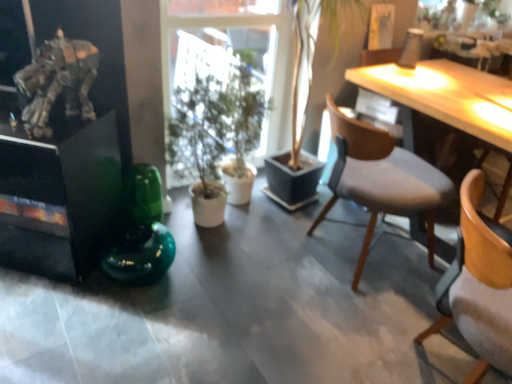
In the scene shown: What is the approximate height of wooden chair at right, which appears as the first chair when viewed from the front?

wooden chair at right, which appears as the first chair when viewed from the front, is 30.81 inches tall.

Based on the photo, measure the distance between point (415, 201) and camera.

Point (415, 201) and camera are 1.80 meters apart from each other.

Find the location of a particular element. Image resolution: width=512 pixels, height=384 pixels. metallic silver robot at upper left is located at coordinates (58, 82).

I want to click on light wood desk at upper right, so click(x=444, y=98).

Identify the location of green matte plant at center. The width and height of the screenshot is (512, 384). (216, 136).

Locate an element on the screen. wooden chair at right, which appears as the first chair when viewed from the front is located at coordinates (478, 285).

Is point (361, 136) in front of point (65, 88)?

Yes, point (361, 136) is closer to viewer.

Which object is positioned more to the left, wooden chair with grey cushion at right, positioned as the first chair in back-to-front order, or metallic silver robot at upper left?

metallic silver robot at upper left.

Which of these two, wooden chair with grey cushion at right, which ranks as the 2th chair in front-to-back order, or metallic silver robot at upper left, is thinner?

Thinner between the two is metallic silver robot at upper left.

Considering their positions, is green glass vase at center located in front of or behind metallic silver robot at upper left?

In the image, green glass vase at center appears behind metallic silver robot at upper left.

Who is shorter, green glass vase at center or metallic silver robot at upper left?

metallic silver robot at upper left is shorter.

Is green glass vase at center not near metallic silver robot at upper left?

They are positioned close to each other.

Considering the sizes of objects green glass vase at center and metallic silver robot at upper left in the image provided, who is wider, green glass vase at center or metallic silver robot at upper left?

metallic silver robot at upper left.

Considering the positions of objects metallic silver robot at upper left and green glass vase at center in the image provided, who is more to the left, metallic silver robot at upper left or green glass vase at center?

From the viewer's perspective, metallic silver robot at upper left appears more on the left side.

From a real-world perspective, is metallic silver robot at upper left above or below green glass vase at center?

metallic silver robot at upper left is above green glass vase at center.

Is green glass vase at center at the back of metallic silver robot at upper left?

metallic silver robot at upper left is not turned away from green glass vase at center.

Is green matte plant at center beside green glass vase at center?

No, green matte plant at center is not in contact with green glass vase at center.

From the image's perspective, which one is positioned lower, green matte plant at center or green glass vase at center?

green glass vase at center.

In the scene shown: Would you say green glass vase at center is part of green matte plant at center's contents?

No.

From the picture: Does metallic silver robot at upper left touch wooden chair with grey cushion at right, which ranks as the 2th chair in front-to-back order?

No, metallic silver robot at upper left is not next to wooden chair with grey cushion at right, which ranks as the 2th chair in front-to-back order.

Would you say wooden chair with grey cushion at right, positioned as the first chair in back-to-front order, is part of metallic silver robot at upper left's contents?

No.

From the picture: Which of these two, metallic silver robot at upper left or wooden chair with grey cushion at right, positioned as the first chair in back-to-front order, stands taller?

wooden chair with grey cushion at right, positioned as the first chair in back-to-front order.

Does point (145, 192) come in front of point (434, 218)?

Yes, point (145, 192) is in front of point (434, 218).

From a real-world perspective, is green glass vase at center physically located above or below wooden chair with grey cushion at right, positioned as the first chair in back-to-front order?

green glass vase at center is situated lower than wooden chair with grey cushion at right, positioned as the first chair in back-to-front order, in the real world.

Which of these two, green glass vase at center or wooden chair with grey cushion at right, positioned as the first chair in back-to-front order, is smaller?

green glass vase at center is smaller.

Who is taller, green glass vase at center or wooden chair with grey cushion at right, which ranks as the 2th chair in front-to-back order?

wooden chair with grey cushion at right, which ranks as the 2th chair in front-to-back order, is taller.

From the picture: Considering the relative sizes of wooden chair with grey cushion at right, positioned as the first chair in back-to-front order, and light wood desk at upper right in the image provided, is wooden chair with grey cushion at right, positioned as the first chair in back-to-front order, wider than light wood desk at upper right?

Correct, the width of wooden chair with grey cushion at right, positioned as the first chair in back-to-front order, exceeds that of light wood desk at upper right.

From a real-world perspective, is wooden chair with grey cushion at right, positioned as the first chair in back-to-front order, positioned above or below light wood desk at upper right?

In terms of real-world spatial position, wooden chair with grey cushion at right, positioned as the first chair in back-to-front order, is below light wood desk at upper right.

This screenshot has height=384, width=512. Find the location of `the 1st chair below when counting from the metallic silver robot at upper left (from the image's perspective)`. the 1st chair below when counting from the metallic silver robot at upper left (from the image's perspective) is located at coordinates (381, 179).

The height and width of the screenshot is (384, 512). Identify the location of art in front of the green glass vase at center. (58, 82).

Considering their positions, is wooden chair at right, which appears as the first chair when viewed from the front, positioned closer to green matte plant at center than light wood desk at upper right?

Among the two, light wood desk at upper right is located nearer to green matte plant at center.

Which object lies further to the anchor point green matte plant at center, wooden chair with grey cushion at right, which ranks as the 2th chair in front-to-back order, or light wood desk at upper right?

light wood desk at upper right is further to green matte plant at center.

Which object lies nearer to the anchor point green glass vase at center, wooden chair with grey cushion at right, which ranks as the 2th chair in front-to-back order, or metallic silver robot at upper left?

metallic silver robot at upper left lies closer to green glass vase at center than the other object.

Considering their positions, is wooden chair with grey cushion at right, which ranks as the 2th chair in front-to-back order, positioned closer to green glass vase at center than wooden chair at right, positioned as the second chair in back-to-front order?

wooden chair with grey cushion at right, which ranks as the 2th chair in front-to-back order, is positioned closer to the anchor green glass vase at center.

Based on their spatial positions, is green matte plant at center or wooden chair at right, positioned as the second chair in back-to-front order, closer to light wood desk at upper right?

Based on the image, green matte plant at center appears to be nearer to light wood desk at upper right.

From the image, which object appears to be nearer to green glass vase at center, wooden chair with grey cushion at right, which ranks as the 2th chair in front-to-back order, or green matte plant at center?

Based on the image, green matte plant at center appears to be nearer to green glass vase at center.

Based on their spatial positions, is green glass vase at center or metallic silver robot at upper left further from light wood desk at upper right?

Based on the image, metallic silver robot at upper left appears to be further to light wood desk at upper right.

Which object lies further to the anchor point metallic silver robot at upper left, green glass vase at center or light wood desk at upper right?

Among the two, light wood desk at upper right is located further to metallic silver robot at upper left.

Locate an element on the screen. The height and width of the screenshot is (384, 512). toy between metallic silver robot at upper left and light wood desk at upper right is located at coordinates (141, 233).

Identify the location of houseplant situated between metallic silver robot at upper left and light wood desk at upper right from left to right. (216, 136).

This screenshot has height=384, width=512. Identify the location of houseplant located between metallic silver robot at upper left and wooden chair with grey cushion at right, positioned as the first chair in back-to-front order, in the left-right direction. (216, 136).

You are a GUI agent. You are given a task and a screenshot of the screen. Output one action in this format:
    pyautogui.click(x=<x>, y=<y>)
    Task: Click on the chair positioned between wooden chair at right, positioned as the second chair in back-to-front order, and light wood desk at upper right from near to far
    The height and width of the screenshot is (384, 512).
    Given the screenshot: What is the action you would take?
    pyautogui.click(x=381, y=179)